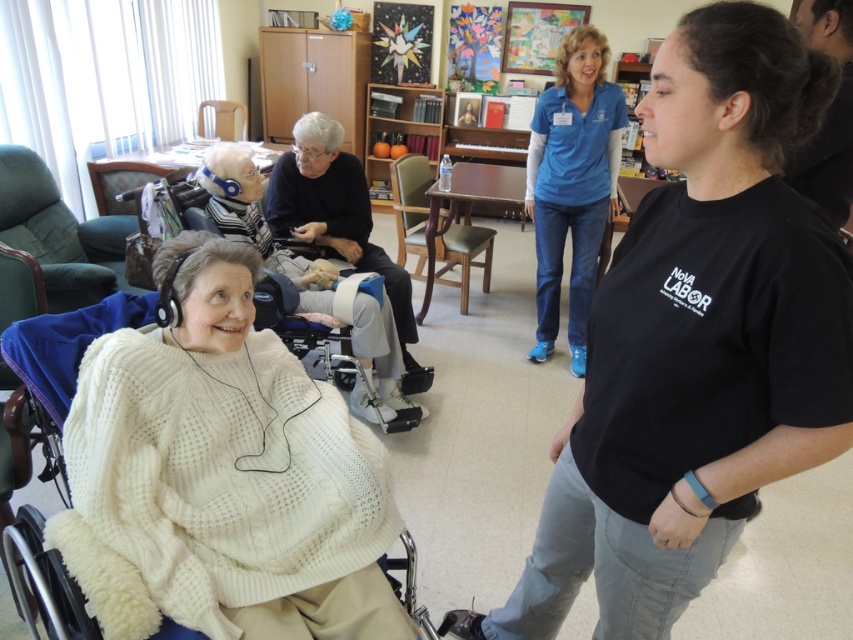
You are standing in the community center and want to place a small potted plant between the two points, point (798,195) and point (146,237). Since the plant needs to be placed closer to the viewer, which point should you choose?

Point (798,195) is closer to the viewer than point (146,237), so you should place the plant near point (798,195) to have it closer to the viewer.